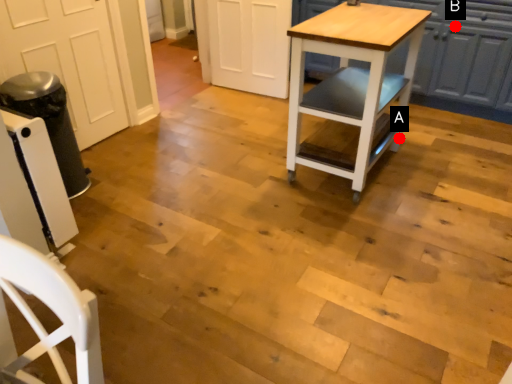
Question: Two points are circled on the image, labeled by A and B beside each circle. Which point appears closest to the camera in this image?

Choices:
 (A) A is closer
 (B) B is closer

Answer: (A)